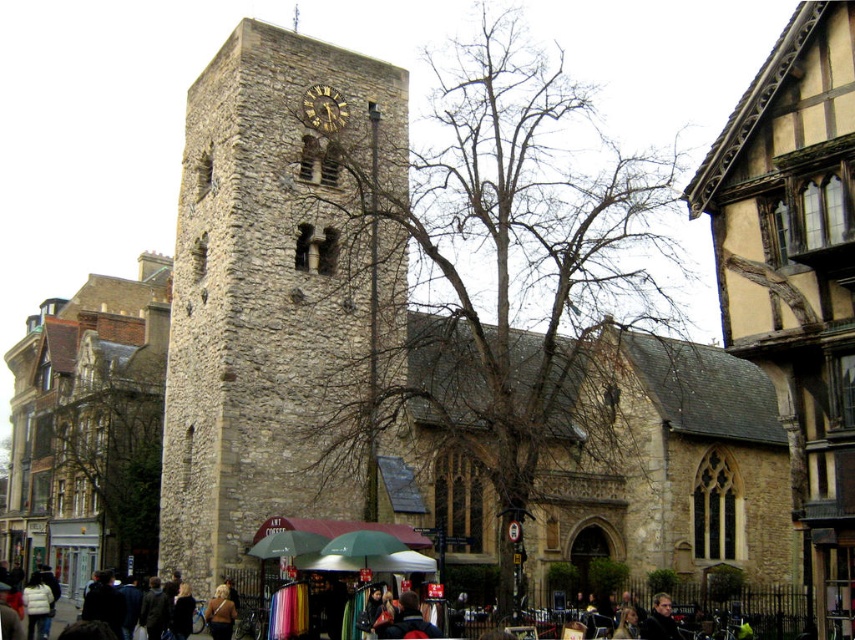
Between wooden half-timbered building at right and golden hair at lower center, which one appears on the right side from the viewer's perspective?

wooden half-timbered building at right is more to the right.

Based on the photo, does wooden half-timbered building at right lie behind golden hair at lower center?

No, it is not.

Identify the location of wooden half-timbered building at right. (797, 275).

Does stone tower at center appear on the left side of dark brown stone clock at center?

Yes, stone tower at center is to the left of dark brown stone clock at center.

Looking at this image, is stone tower at center smaller than dark brown stone clock at center?

No, stone tower at center is not smaller than dark brown stone clock at center.

Is point (75, 536) positioned before point (317, 125)?

No.

Locate an element on the screen. stone tower at center is located at coordinates (x=87, y=428).

Can you confirm if dark brown stone clock at center is positioned to the left of golden hair at lower center?

Incorrect, dark brown stone clock at center is not on the left side of golden hair at lower center.

Which is more to the right, dark brown stone clock at center or golden hair at lower center?

dark brown stone clock at center

Is point (334, 118) positioned before point (230, 605)?

No, (334, 118) is further to viewer.

Where is `dark brown stone clock at center`? This screenshot has height=640, width=855. dark brown stone clock at center is located at coordinates (323, 108).